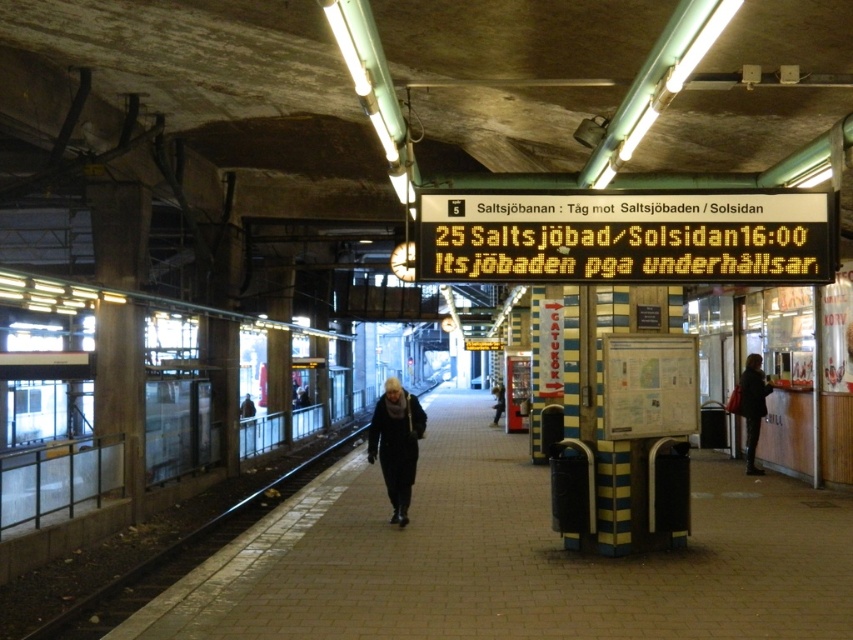
Question: Among these objects, which one is nearest to the camera?

Choices:
 (A) black metal train track at left
 (B) dark blue coat at center

Answer: (A)

Question: Based on their relative distances, which object is nearer to the black metal train track at left?

Choices:
 (A) yellow digital display at center
 (B) dark gray coat at right
 (C) dark gray coat at center

Answer: (A)

Question: Which of the following is the farthest from the observer?

Choices:
 (A) (236, 509)
 (B) (247, 397)

Answer: (B)

Question: Does yellow digital display at center appear over dark gray coat at right?

Choices:
 (A) no
 (B) yes

Answer: (B)

Question: Does dark blue coat at center appear on the right side of dark gray coat at right?

Choices:
 (A) no
 (B) yes

Answer: (A)

Question: Does black metal train track at left appear over dark gray jacket at left?

Choices:
 (A) yes
 (B) no

Answer: (B)